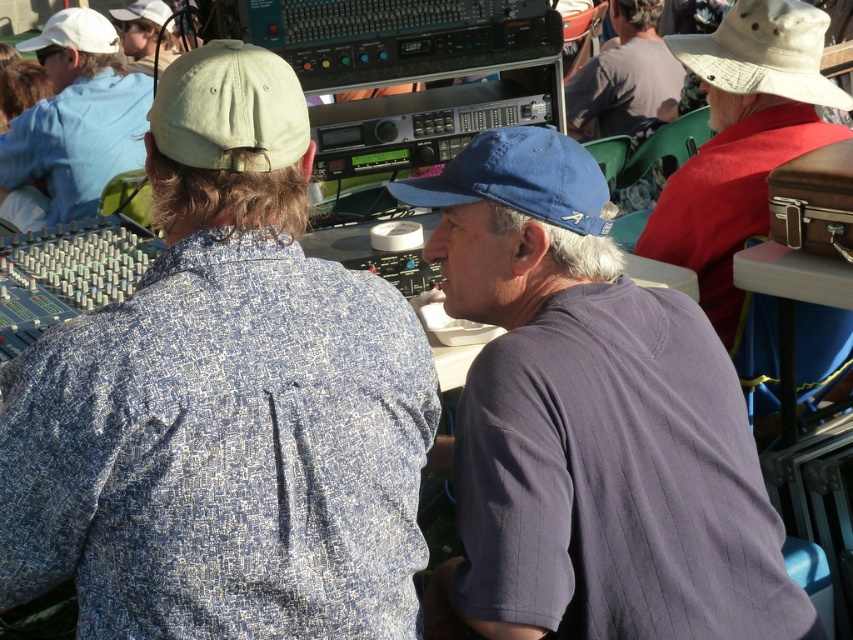
Can you confirm if dark blue fabric shirt at center is bigger than light brown leather jacket at upper right?

Actually, dark blue fabric shirt at center might be smaller than light brown leather jacket at upper right.

Image resolution: width=853 pixels, height=640 pixels. In order to click on dark blue fabric shirt at center in this screenshot , I will do `click(590, 422)`.

Describe the element at coordinates (763, 52) in the screenshot. I see `khaki fabric baseball hat at upper right` at that location.

Between khaki fabric baseball hat at upper right and light brown leather jacket at upper right, which one is positioned higher?

Positioned higher is light brown leather jacket at upper right.

Does point (786, 52) come behind point (633, 64)?

No, it is in front of (633, 64).

Identify the location of khaki fabric baseball hat at upper right. (763, 52).

Can you confirm if dark blue fabric shirt at center is positioned below white matte cap at upper left?

Yes.

This screenshot has height=640, width=853. What do you see at coordinates (590, 422) in the screenshot?
I see `dark blue fabric shirt at center` at bounding box center [590, 422].

Does point (543, 193) come closer to viewer compared to point (78, 144)?

Yes, it is in front of point (78, 144).

This screenshot has width=853, height=640. Find the location of `dark blue fabric shirt at center`. dark blue fabric shirt at center is located at coordinates (590, 422).